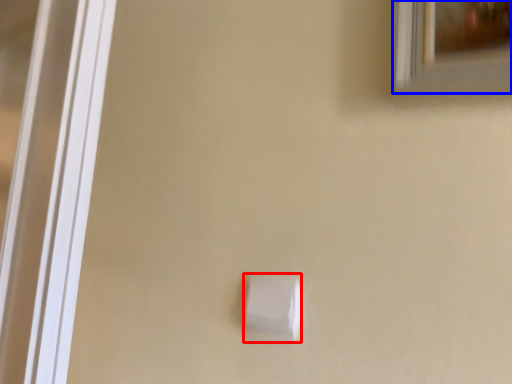
Question: Which point is closer to the camera, light switch (highlighted by a red box) or window (highlighted by a blue box)?

Choices:
 (A) light switch
 (B) window

Answer: (B)